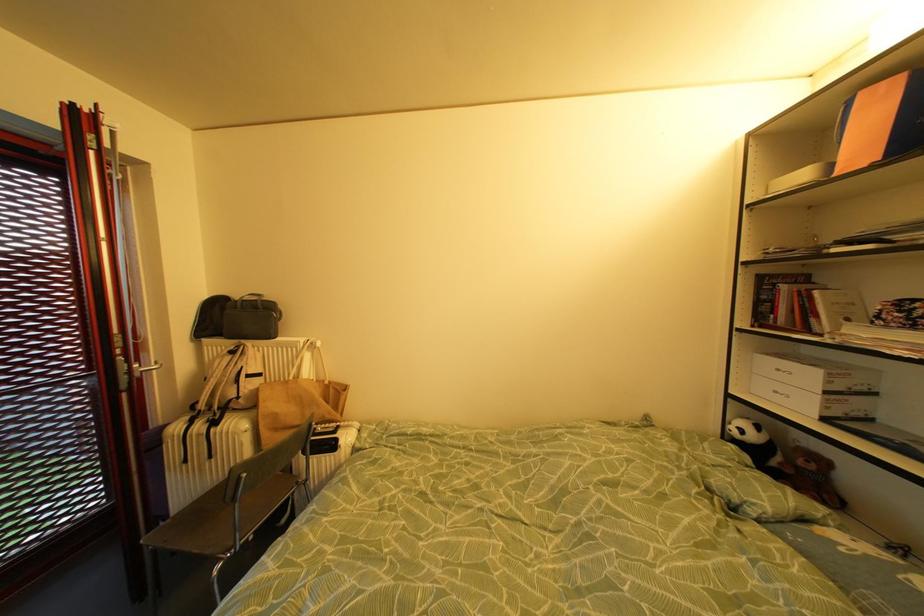
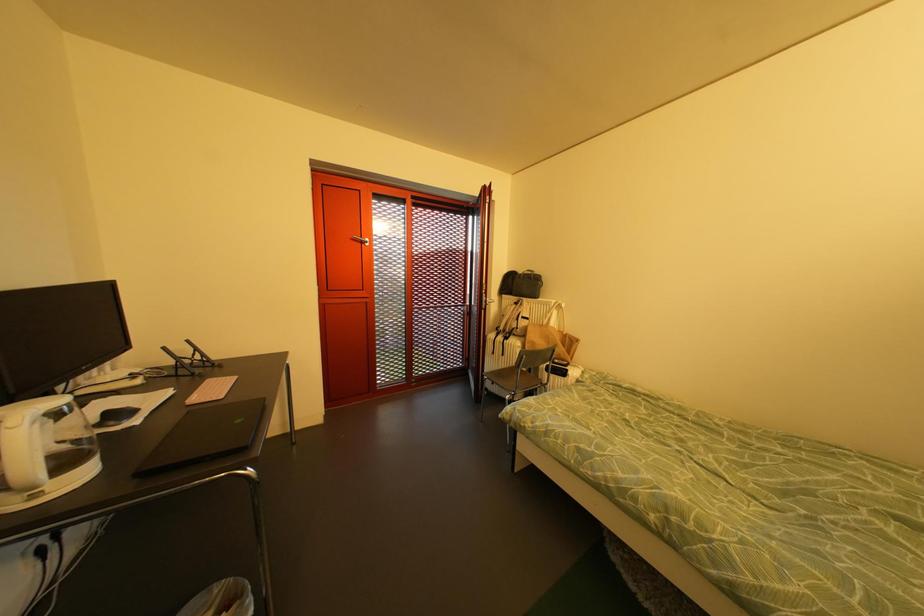
Question: The camera is either moving clockwise (left) or counter-clockwise (right) around the object. The first image is from the beginning of the video and the second image is from the end. Is the camera moving left or right when shooting the video?

Choices:
 (A) Left
 (B) Right

Answer: (B)